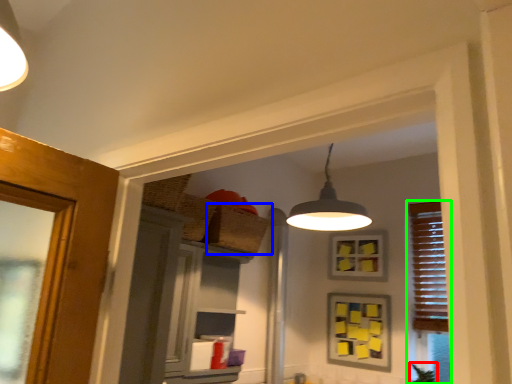
Question: Considering the real-world distances, which object is closest to plant (highlighted by a red box)? basket (highlighted by a blue box) or window (highlighted by a green box).

Choices:
 (A) basket
 (B) window

Answer: (B)